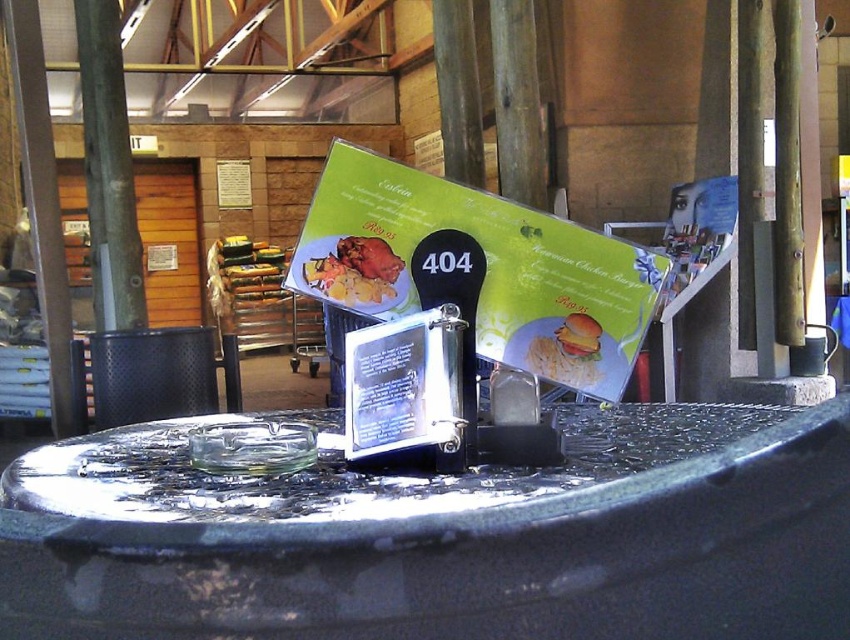
Locate an element on the screen. golden fried chicken at center is located at coordinates (244, 273).

Locate an element on the screen. golden fried chicken at center is located at coordinates (244, 273).

Does metallic pole at center appear on the left side of golden crispy hamburger at center?

Correct, you'll find metallic pole at center to the left of golden crispy hamburger at center.

Between metallic pole at center and golden crispy hamburger at center, which one has less height?

Standing shorter between the two is golden crispy hamburger at center.

Does point (110, 220) lie in front of point (544, 368)?

No.

This screenshot has height=640, width=850. I want to click on metallic pole at center, so click(108, 168).

Is point (21, 611) behind point (542, 328)?

No, it is in front of (542, 328).

Does shiny glass table at center appear over golden crispy hamburger at center?

No, shiny glass table at center is not above golden crispy hamburger at center.

Is point (353, 602) closer to viewer compared to point (575, 320)?

Yes.

Locate an element on the screen. shiny glass table at center is located at coordinates (442, 536).